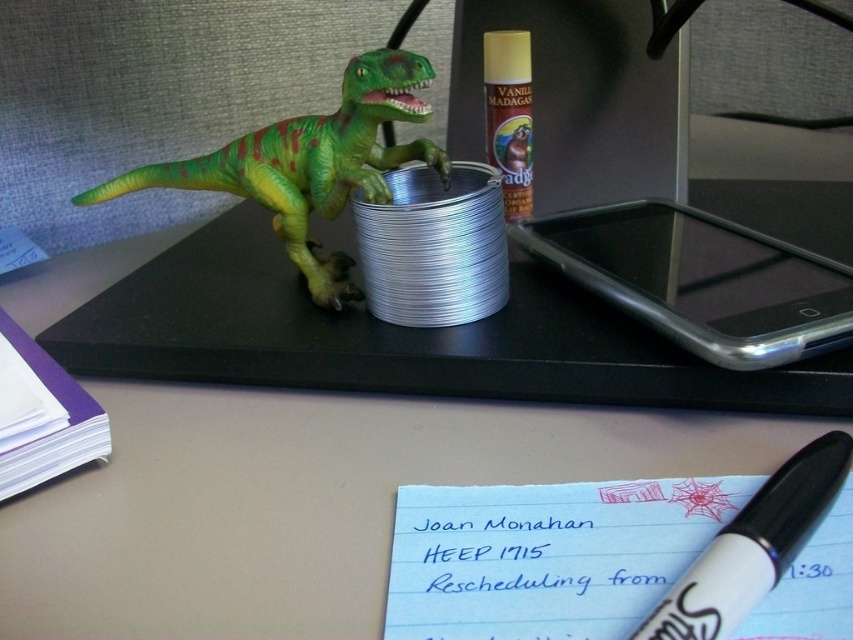
Can you confirm if green matte plastic dinosaur at upper left is thinner than white marker pen at lower right?

Result: No, green matte plastic dinosaur at upper left is not thinner than white marker pen at lower right.

What do you see at coordinates (311, 163) in the screenshot? I see `green matte plastic dinosaur at upper left` at bounding box center [311, 163].

Is point (341, 90) behind point (753, 509)?

That is True.

You are a GUI agent. You are given a task and a screenshot of the screen. Output one action in this format:
    pyautogui.click(x=<x>, y=<y>)
    Task: Click on the green matte plastic dinosaur at upper left
    
    Given the screenshot: What is the action you would take?
    pyautogui.click(x=311, y=163)